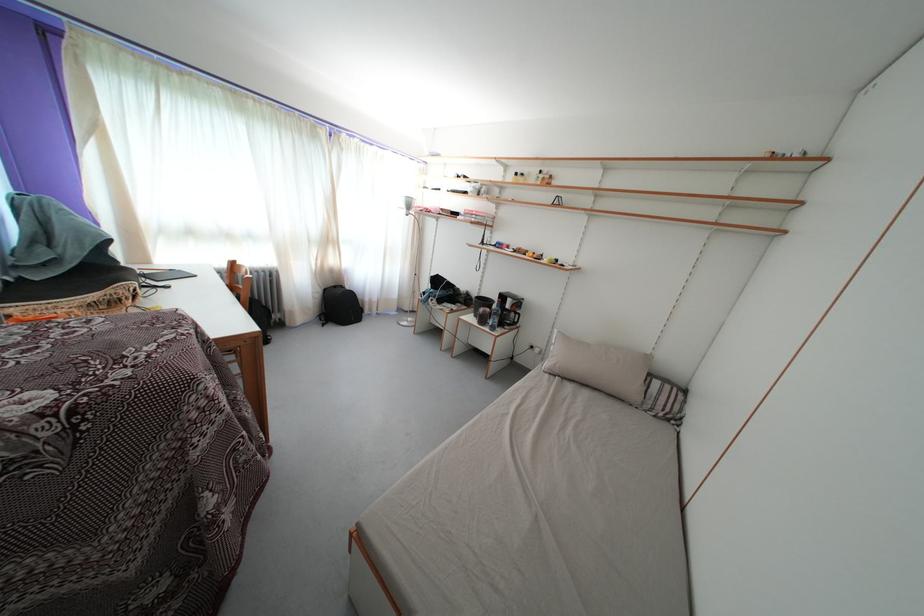
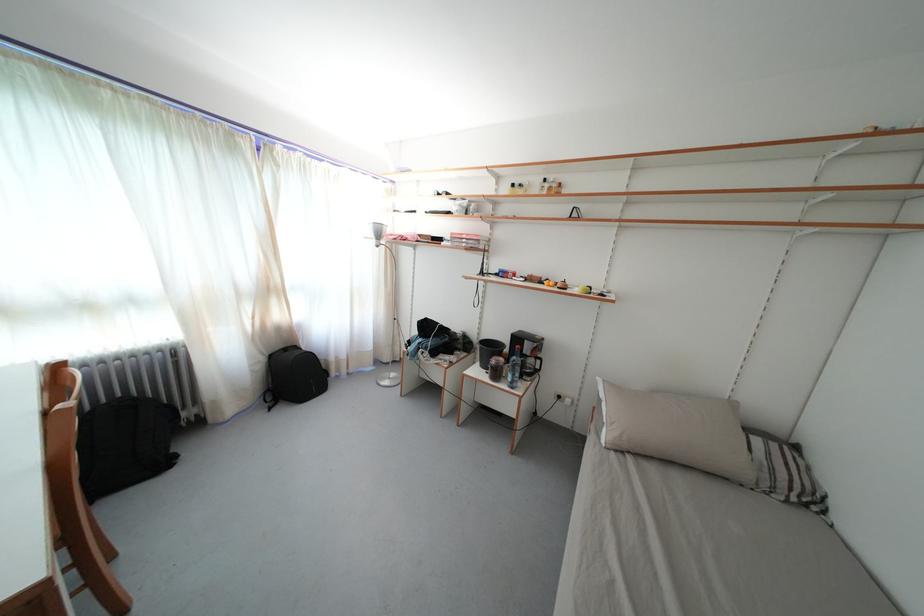
Locate, in the second image, the point that corresponds to (x=508, y=302) in the first image.

(524, 345)